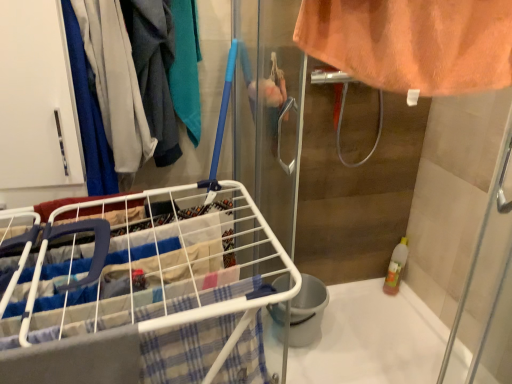
Question: From a real-world perspective, is matte blue fabric at left positioned over white glossy bath at lower right based on gravity?

Choices:
 (A) no
 (B) yes

Answer: (B)

Question: Does matte blue fabric at left have a lesser height compared to white glossy bath at lower right?

Choices:
 (A) yes
 (B) no

Answer: (B)

Question: Is the position of matte blue fabric at left less distant than that of white glossy bath at lower right?

Choices:
 (A) yes
 (B) no

Answer: (A)

Question: Can you confirm if matte blue fabric at left is positioned to the right of white glossy bath at lower right?

Choices:
 (A) no
 (B) yes

Answer: (A)

Question: Does matte blue fabric at left lie behind white glossy bath at lower right?

Choices:
 (A) no
 (B) yes

Answer: (A)

Question: In the image, is matte blue fabric at left positioned in front of or behind white glossy bath at lower right?

Choices:
 (A) behind
 (B) front

Answer: (B)

Question: Based on their positions, is matte blue fabric at left located to the left or right of white glossy bath at lower right?

Choices:
 (A) right
 (B) left

Answer: (B)

Question: Looking at their shapes, would you say matte blue fabric at left is wider or thinner than white glossy bath at lower right?

Choices:
 (A) thin
 (B) wide

Answer: (A)

Question: Looking at the image, does matte blue fabric at left seem bigger or smaller compared to white glossy bath at lower right?

Choices:
 (A) small
 (B) big

Answer: (A)

Question: In terms of height, does white glossy bath at lower right look taller or shorter compared to white wire laundry cart at lower left?

Choices:
 (A) tall
 (B) short

Answer: (B)

Question: Relative to white wire laundry cart at lower left, is white glossy bath at lower right in front or behind?

Choices:
 (A) behind
 (B) front

Answer: (A)

Question: Is point (394, 357) closer or farther from the camera than point (7, 314)?

Choices:
 (A) farther
 (B) closer

Answer: (A)

Question: Considering the relative positions of white glossy bath at lower right and white wire laundry cart at lower left in the image provided, is white glossy bath at lower right to the left or to the right of white wire laundry cart at lower left?

Choices:
 (A) left
 (B) right

Answer: (B)

Question: Which is correct: white wire laundry cart at lower left is inside white glossy bath at lower right, or outside of it?

Choices:
 (A) outside
 (B) inside

Answer: (A)

Question: Is white wire laundry cart at lower left taller or shorter than white glossy bath at lower right?

Choices:
 (A) tall
 (B) short

Answer: (A)